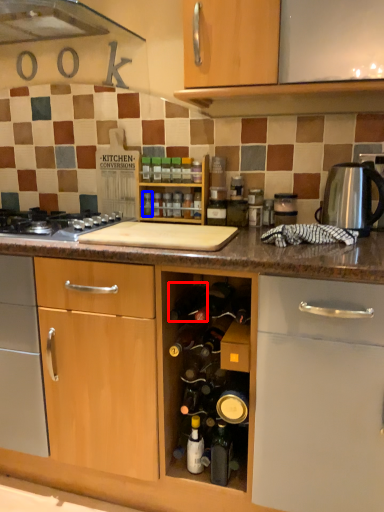
Question: Which of the following is the closest to the observer, wine bottle (highlighted by a red box) or bottle (highlighted by a blue box)?

Choices:
 (A) wine bottle
 (B) bottle

Answer: (A)